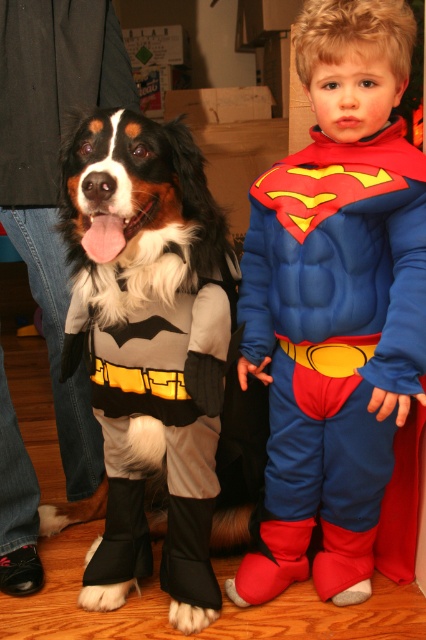
Question: Does blue fleece suit at center have a lesser width compared to fluffy fur dog at center?

Choices:
 (A) yes
 (B) no

Answer: (B)

Question: Is blue fleece suit at center to the right of fluffy fur dog at center from the viewer's perspective?

Choices:
 (A) yes
 (B) no

Answer: (A)

Question: Which point is farther from the camera taking this photo?

Choices:
 (A) (305, 49)
 (B) (118, 188)

Answer: (A)

Question: Is blue fleece suit at center thinner than fluffy fur dog at center?

Choices:
 (A) yes
 (B) no

Answer: (B)